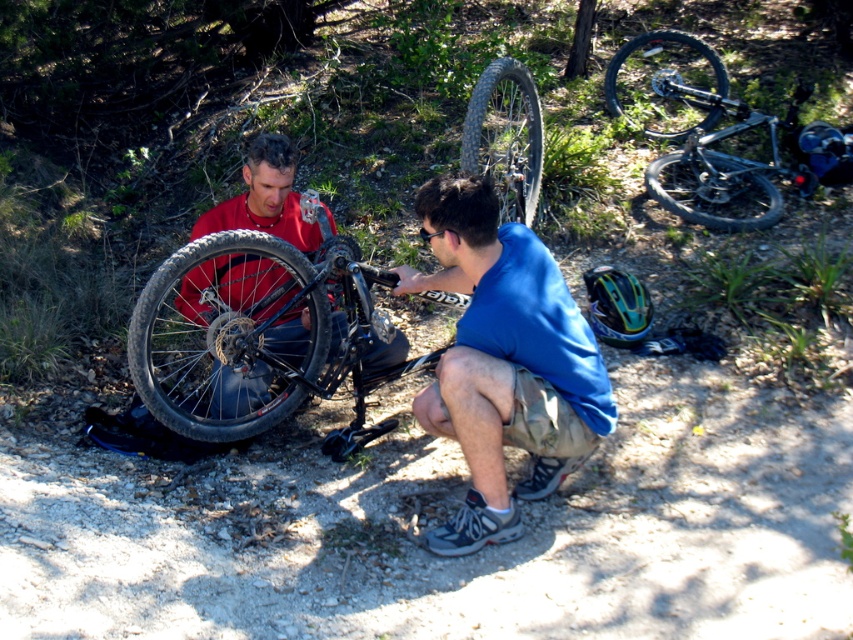
Does black matte bicycle wheel at center-left have a greater width compared to black matte mountain bike at upper right?

No, black matte bicycle wheel at center-left is not wider than black matte mountain bike at upper right.

Between black matte bicycle wheel at center-left and black matte mountain bike at upper right, which one appears on the right side from the viewer's perspective?

black matte mountain bike at upper right

Is point (143, 394) farther from camera compared to point (697, 177)?

No.

You are a GUI agent. You are given a task and a screenshot of the screen. Output one action in this format:
    pyautogui.click(x=<x>, y=<y>)
    Task: Click on the black matte bicycle wheel at center-left
    This screenshot has width=853, height=640.
    Given the screenshot: What is the action you would take?
    pyautogui.click(x=229, y=333)

Which is more to the left, black matte bicycle wheel at center-left or black rubber tire at upper right?

From the viewer's perspective, black matte bicycle wheel at center-left appears more on the left side.

Is black matte bicycle wheel at center-left below black rubber tire at upper right?

Yes.

Which is in front, point (183, 358) or point (688, 184)?

Point (183, 358)

Locate an element on the screen. Image resolution: width=853 pixels, height=640 pixels. black matte bicycle wheel at center-left is located at coordinates (229, 333).

Describe the element at coordinates (665, 83) in the screenshot. The width and height of the screenshot is (853, 640). I see `black matte bicycle wheel at upper right` at that location.

Is point (608, 68) closer to viewer compared to point (735, 179)?

No, it is behind (735, 179).

Describe the element at coordinates (665, 83) in the screenshot. I see `black matte bicycle wheel at upper right` at that location.

Identify the location of black matte bicycle wheel at upper right. (665, 83).